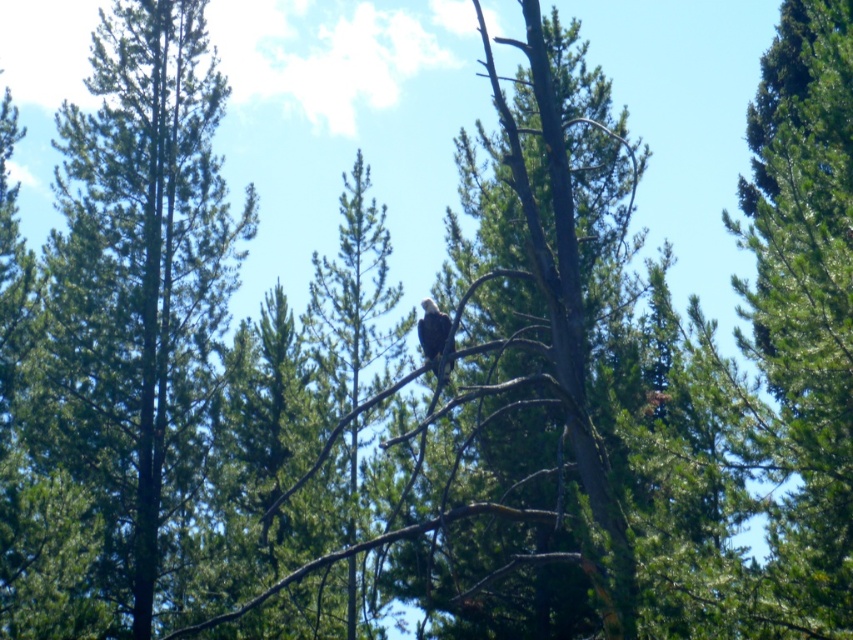
From the picture: You are a birdwatcher observing the scene. You notice the green textured tree at left and the white feathered eagle at center. Which object is positioned to the left of the other?

The green textured tree at left is positioned to the left of the white feathered eagle at center.

You are standing in the forest looking at the tall evergreen trees. There is a point marked at coordinates (140, 275). Which object from the scene does this point belong to?

The point at coordinates (140, 275) is on the green textured tree at left.